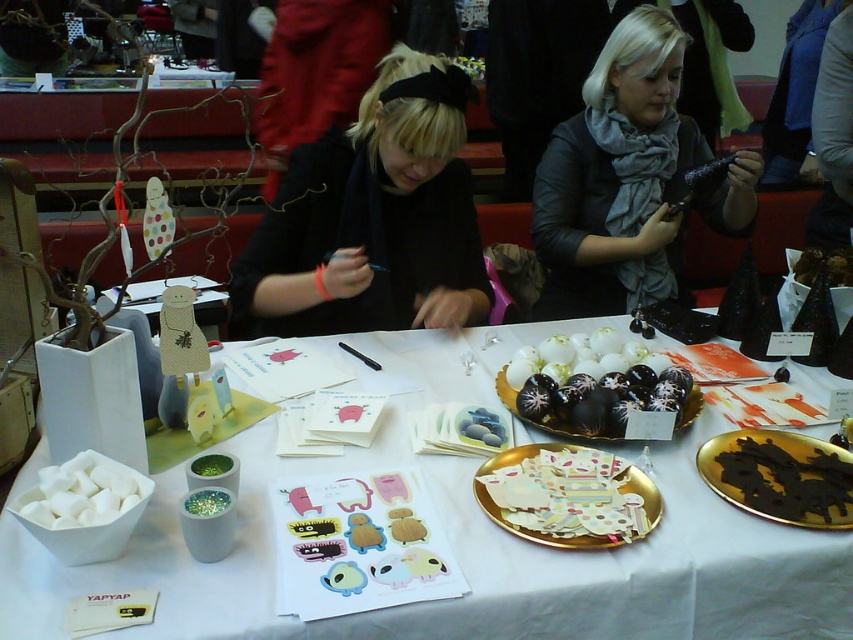
You are organizing an art workshop and need to place a decorative item between the black matte scarf at upper center and the paper cutouts at center. What is the minimum length of the decorative item required to fit snugly between them?

Result: The distance between the black matte scarf at upper center and the paper cutouts at center is 65.16 centimeters, so the decorative item needs to be at least 65.16 centimeters long to fit snugly between them.